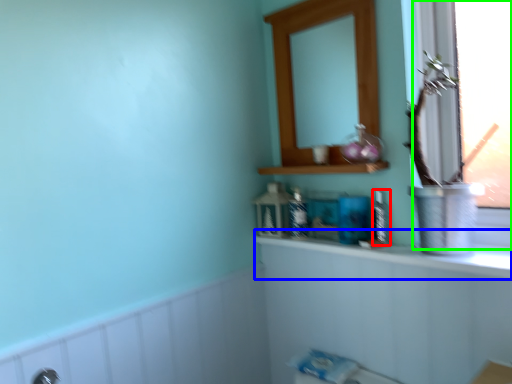
Question: Estimate the real-world distances between objects in this image. Which object is closer to toiletry (highlighted by a red box), counter top (highlighted by a blue box) or window (highlighted by a green box)?

Choices:
 (A) counter top
 (B) window

Answer: (A)